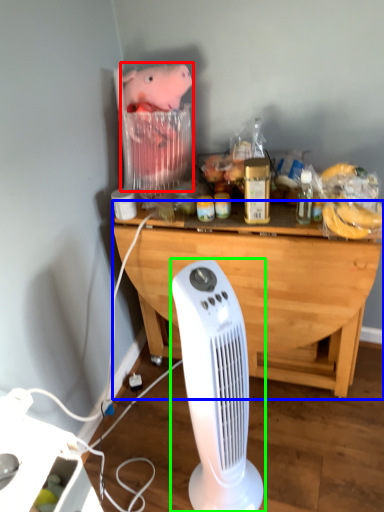
Question: Based on their relative distances, which object is nearer to animal (highlighted by a red box)? Choose from desk (highlighted by a blue box) and home appliance (highlighted by a green box).

Choices:
 (A) desk
 (B) home appliance

Answer: (A)